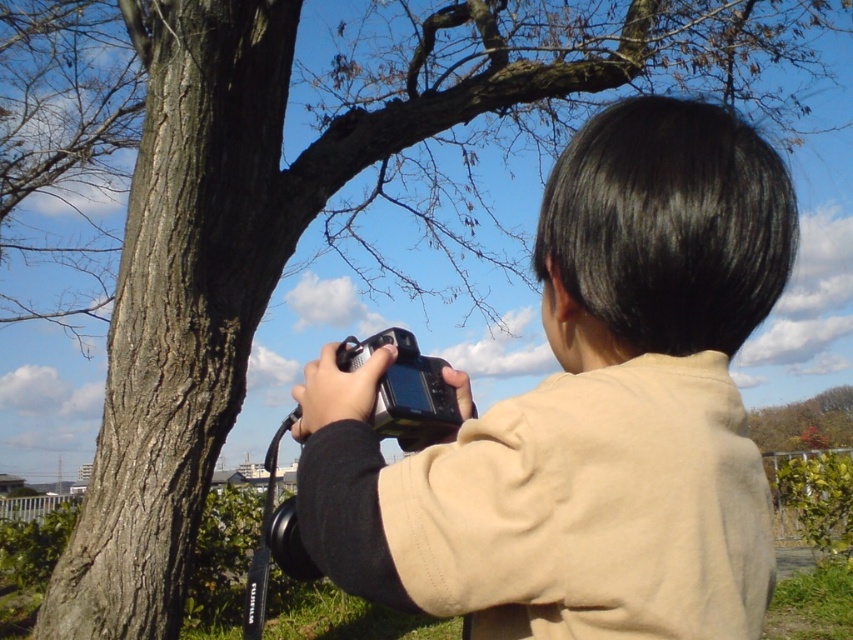
Can you confirm if matte black camera at center is positioned to the right of black plastic camera at center?

Correct, you'll find matte black camera at center to the right of black plastic camera at center.

Measure the distance from matte black camera at center to black plastic camera at center.

9.41 inches

At what (x,y) coordinates should I click in order to perform the action: click on matte black camera at center. Please return your answer as a coordinate pair (x, y). The image size is (853, 640). Looking at the image, I should click on (587, 412).